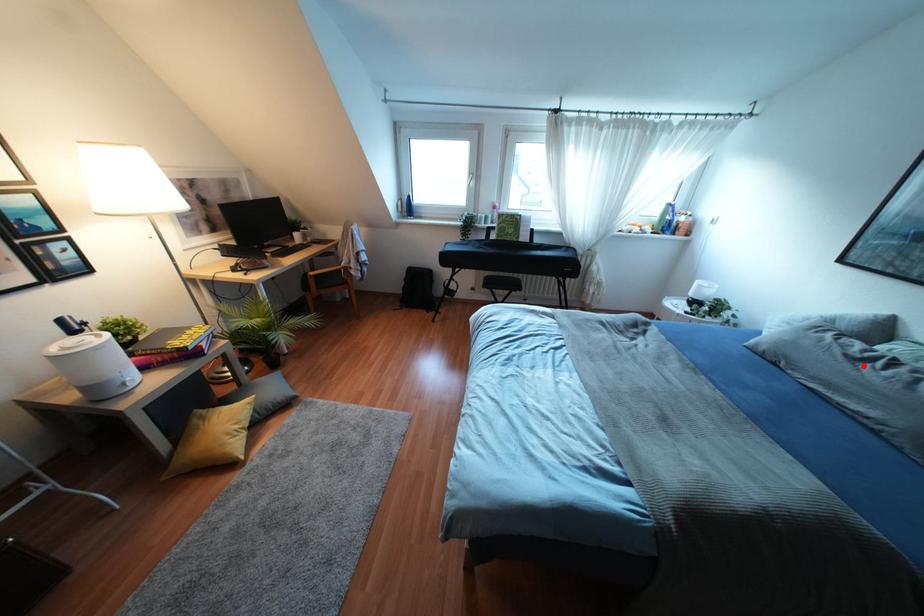
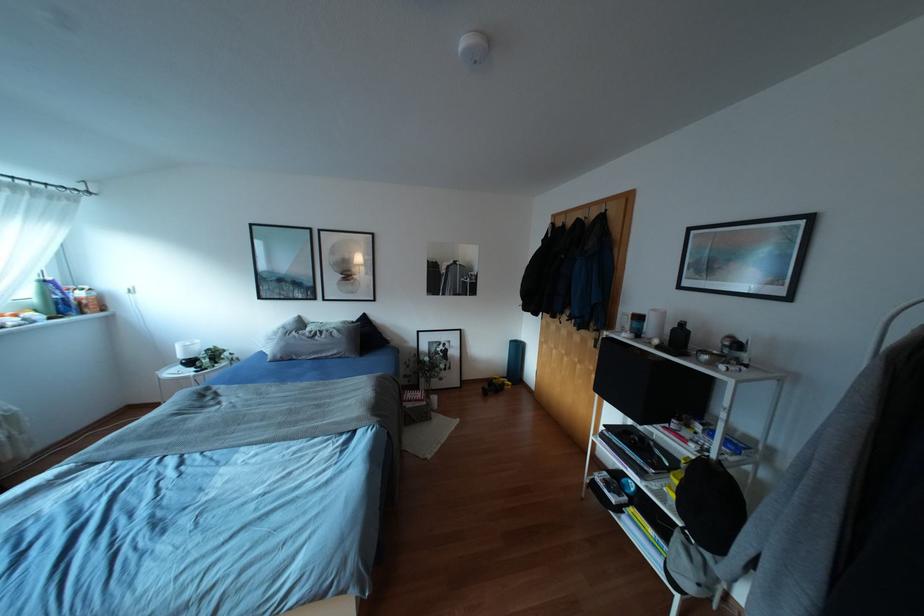
Where in the second image is the point corresponding to the highlighted location from the first image?

(315, 338)